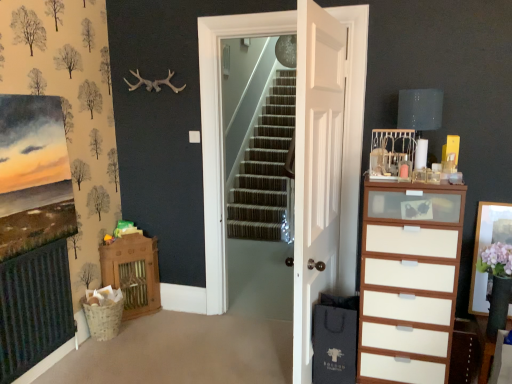
Question: From a real-world perspective, is white wood chest of drawers at right physically above matte gray lampshade at upper right?

Choices:
 (A) no
 (B) yes

Answer: (A)

Question: Is white wood chest of drawers at right turned away from matte gray lampshade at upper right?

Choices:
 (A) no
 (B) yes

Answer: (A)

Question: From the image's perspective, is white wood chest of drawers at right under matte gray lampshade at upper right?

Choices:
 (A) yes
 (B) no

Answer: (A)

Question: Can you confirm if white wood chest of drawers at right is positioned to the right of matte gray lampshade at upper right?

Choices:
 (A) no
 (B) yes

Answer: (A)

Question: Is white wood chest of drawers at right taller than matte gray lampshade at upper right?

Choices:
 (A) yes
 (B) no

Answer: (A)

Question: Would you say white wooden door at center, placed as the 1th door when sorted from front to back, is to the left or to the right of white wooden door at center, the 2th door positioned from the front, in the picture?

Choices:
 (A) left
 (B) right

Answer: (B)

Question: In terms of height, does white wooden door at center, placed as the 1th door when sorted from front to back, look taller or shorter compared to white wooden door at center, positioned as the first door in back-to-front order?

Choices:
 (A) tall
 (B) short

Answer: (B)

Question: From the image's perspective, is white wooden door at center, placed as the 1th door when sorted from front to back, positioned above or below white wooden door at center, positioned as the first door in back-to-front order?

Choices:
 (A) above
 (B) below

Answer: (B)

Question: In terms of width, does white wooden door at center, the 2th door from the back, look wider or thinner when compared to white wooden door at center, positioned as the first door in back-to-front order?

Choices:
 (A) thin
 (B) wide

Answer: (B)

Question: From a real-world perspective, is matte gray lampshade at upper right physically located above or below white wooden door at center, placed as the 1th door when sorted from front to back?

Choices:
 (A) above
 (B) below

Answer: (A)

Question: Considering the positions of point (439, 92) and point (303, 294), is point (439, 92) closer or farther from the camera than point (303, 294)?

Choices:
 (A) farther
 (B) closer

Answer: (A)

Question: Considering the relative positions of matte gray lampshade at upper right and white wooden door at center, placed as the 1th door when sorted from front to back, in the image provided, is matte gray lampshade at upper right to the left or to the right of white wooden door at center, placed as the 1th door when sorted from front to back,?

Choices:
 (A) right
 (B) left

Answer: (A)

Question: Choose the correct answer: Is matte gray lampshade at upper right inside white wooden door at center, the 2th door from the back, or outside it?

Choices:
 (A) inside
 (B) outside

Answer: (B)

Question: In terms of size, does white wood chest of drawers at right appear bigger or smaller than matte gray lampshade at upper right?

Choices:
 (A) small
 (B) big

Answer: (B)

Question: From a real-world perspective, is white wood chest of drawers at right physically located above or below matte gray lampshade at upper right?

Choices:
 (A) below
 (B) above

Answer: (A)